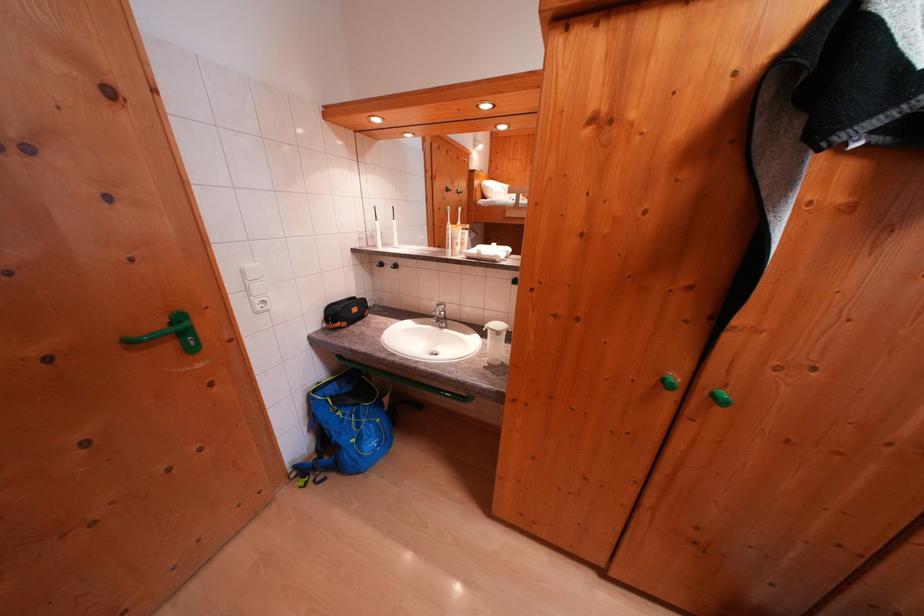
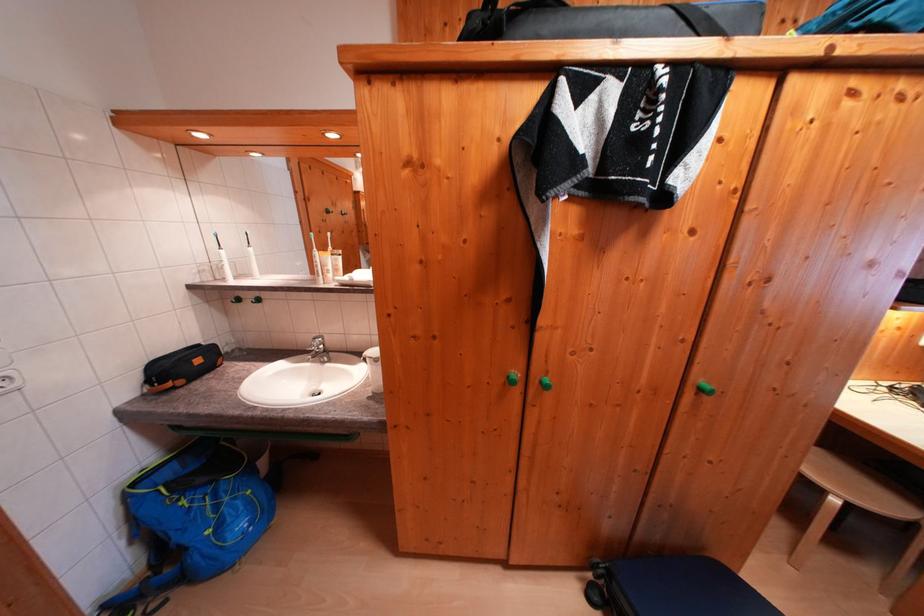
In the second image, find the point that corresponds to point 721,400 in the first image.

(550, 387)